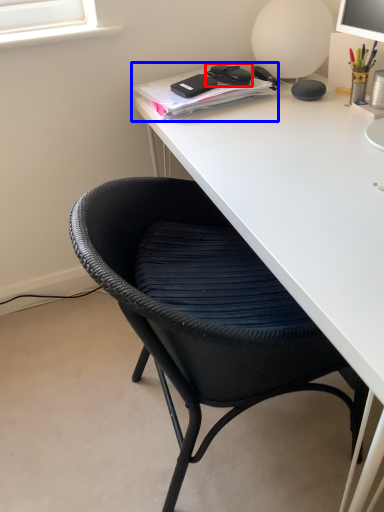
Question: Which object is closer to the camera taking this photo, stationery (highlighted by a red box) or notebook (highlighted by a blue box)?

Choices:
 (A) stationery
 (B) notebook

Answer: (B)